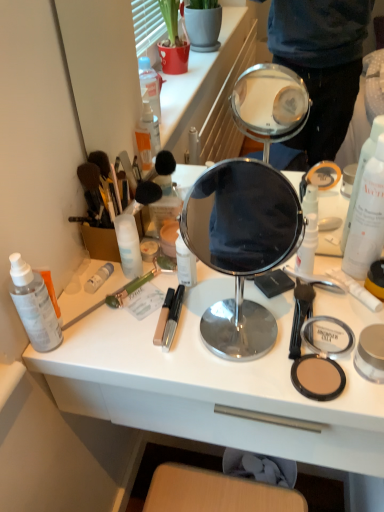
You are a GUI agent. You are given a task and a screenshot of the screen. Output one action in this format:
    pyautogui.click(x=<x>, y=<y>)
    Task: Click on the vacant region to the left of white matte pump bottle at right, acting as the 5th toiletry starting from the left
    This screenshot has height=512, width=384.
    Given the screenshot: What is the action you would take?
    pyautogui.click(x=218, y=296)